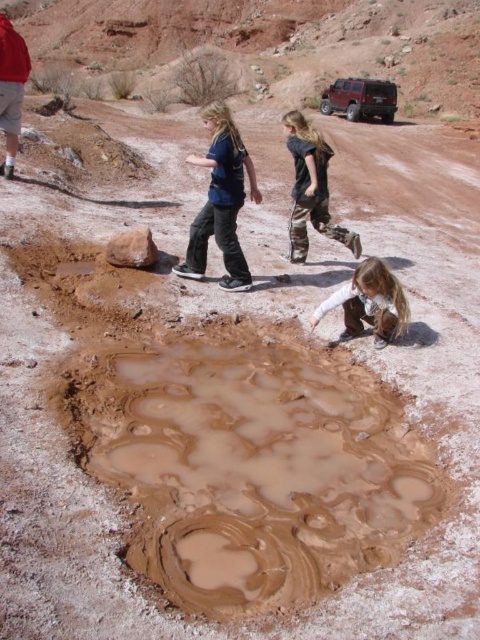
Can you confirm if dark blue jeans at center is positioned below matte red shirt at upper left?

Yes.

Does dark blue jeans at center have a larger size compared to matte red shirt at upper left?

No.

Is point (297, 170) in front of point (2, 33)?

Yes.

I want to click on dark blue jeans at center, so click(x=311, y=188).

Consider the image. Who is positioned more to the right, muddy wet puddle at center or dark blue jeans at center?

dark blue jeans at center is more to the right.

Is muddy wet puddle at center positioned behind dark blue jeans at center?

No.

The height and width of the screenshot is (640, 480). I want to click on muddy wet puddle at center, so click(x=250, y=465).

You are a GUI agent. You are given a task and a screenshot of the screen. Output one action in this format:
    pyautogui.click(x=<x>, y=<y>)
    Task: Click on the muddy wet puddle at center
    This screenshot has width=480, height=640.
    Given the screenshot: What is the action you would take?
    pyautogui.click(x=250, y=465)

Is point (240, 285) farther from camera compared to point (14, 154)?

No, (240, 285) is closer to viewer.

Can you confirm if blue cotton shirt at center is shorter than matte red shirt at upper left?

No, blue cotton shirt at center is not shorter than matte red shirt at upper left.

At what (x,y) coordinates should I click in order to perform the action: click on blue cotton shirt at center. Please return your answer as a coordinate pair (x, y). This screenshot has height=640, width=480. Looking at the image, I should click on (220, 202).

Find the location of `blue cotton shirt at center`. blue cotton shirt at center is located at coordinates (220, 202).